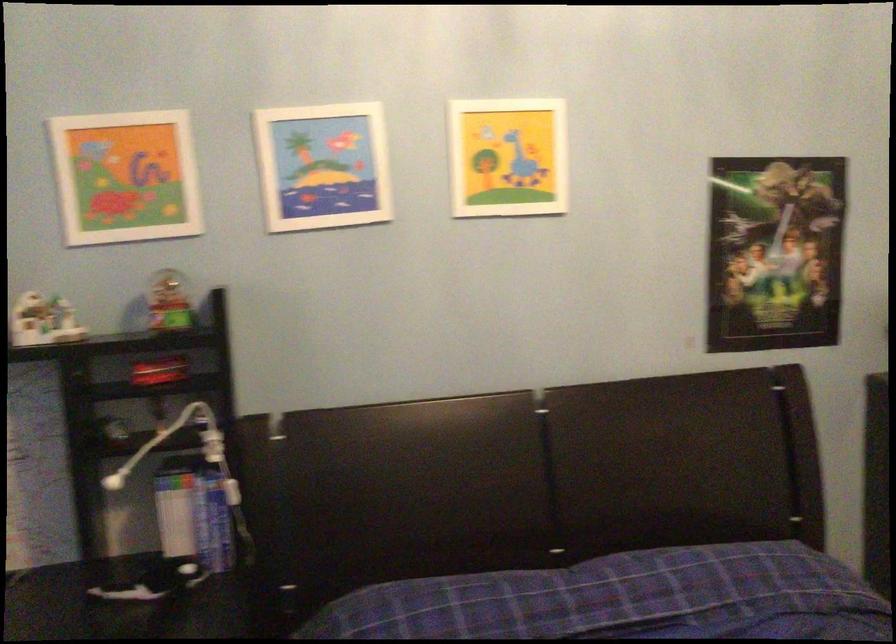
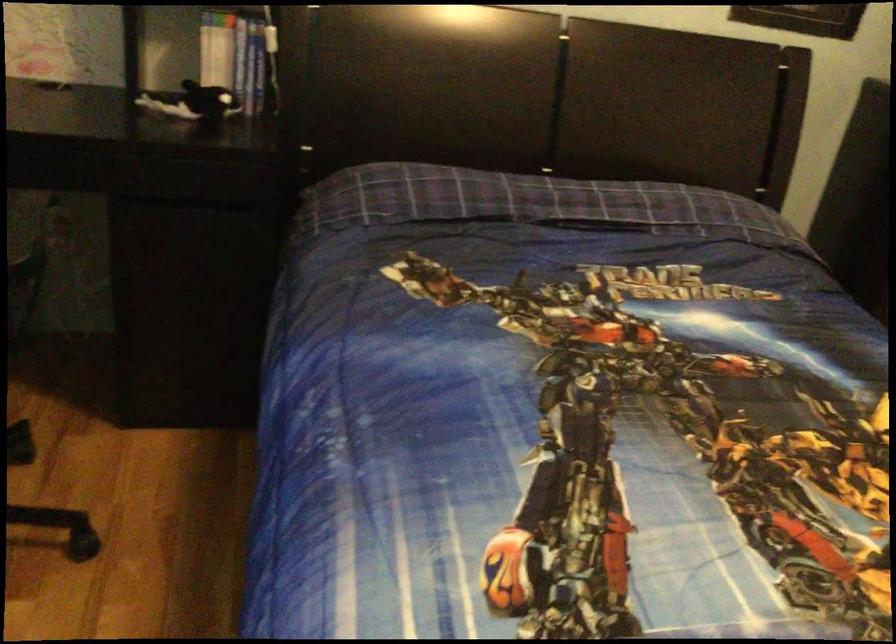
Question: The images are taken continuously from a first-person perspective. In which direction are you moving?

Choices:
 (A) Left
 (B) Right
 (C) Forward
 (D) Backward

Answer: (D)